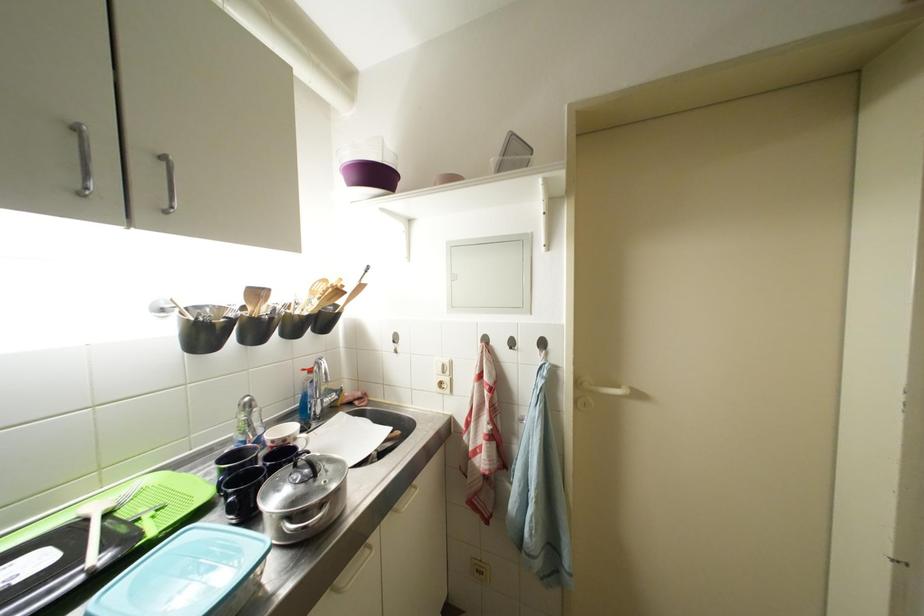
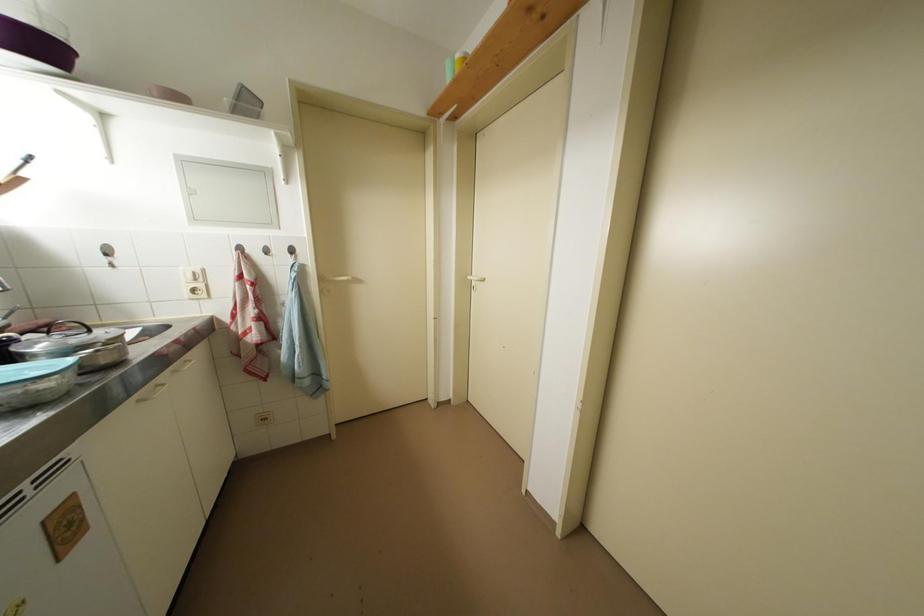
Where in the second image is the point corresponding to point 450,370 from the first image?

(201, 277)